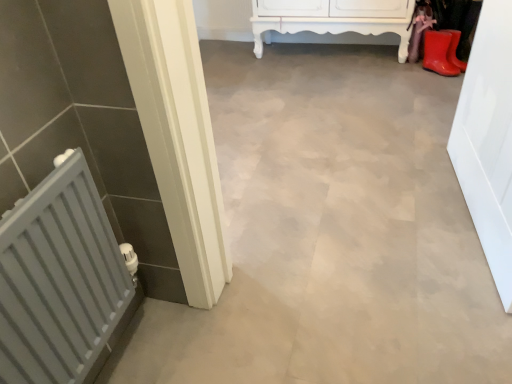
What do you see at coordinates (333, 18) in the screenshot? The height and width of the screenshot is (384, 512). I see `white glossy cabinet at upper center` at bounding box center [333, 18].

This screenshot has width=512, height=384. What do you see at coordinates (488, 140) in the screenshot? I see `white glossy door at right` at bounding box center [488, 140].

Where is `gray matte radiator at left`? The width and height of the screenshot is (512, 384). gray matte radiator at left is located at coordinates (59, 279).

Consider the image. Which is correct: gray matte radiator at left is inside white glossy cabinet at upper center, or outside of it?

The correct answer is: outside.

From a real-world perspective, is gray matte radiator at left located higher than white glossy cabinet at upper center?

Yes.

Is gray matte radiator at left bigger than white glossy cabinet at upper center?

No, gray matte radiator at left is not bigger than white glossy cabinet at upper center.

Between white glossy door at right and gray matte radiator at left, which one appears on the right side from the viewer's perspective?

Positioned to the right is white glossy door at right.

Is there a large distance between white glossy door at right and gray matte radiator at left?

Absolutely, white glossy door at right is distant from gray matte radiator at left.

Locate an element on the screen. This screenshot has width=512, height=384. door behind the gray matte radiator at left is located at coordinates (488, 140).

In terms of size, does white glossy door at right appear bigger or smaller than gray matte radiator at left?

white glossy door at right is bigger than gray matte radiator at left.

Which is nearer, (x=486, y=61) or (x=432, y=48)?

Clearly, point (x=486, y=61) is closer to the camera than point (x=432, y=48).

How different are the orientations of white glossy door at right and rubber matte boot at upper right in degrees?

The angle between the facing direction of white glossy door at right and the facing direction of rubber matte boot at upper right is 137 degrees.

In terms of width, does white glossy door at right look wider or thinner when compared to rubber matte boot at upper right?

Considering their sizes, white glossy door at right looks slimmer than rubber matte boot at upper right.

In the scene shown: Considering the positions of objects white glossy door at right and rubber matte boot at upper right in the image provided, who is more to the right, white glossy door at right or rubber matte boot at upper right?

From the viewer's perspective, rubber matte boot at upper right appears more on the right side.

From the image's perspective, which one is positioned higher, gray matte radiator at left or white glossy door at right?

white glossy door at right, from the image's perspective.

Which of these two, gray matte radiator at left or white glossy door at right, stands taller?

Standing taller between the two is white glossy door at right.

Can you see gray matte radiator at left touching white glossy door at right?

There is a gap between gray matte radiator at left and white glossy door at right.

Looking at this image, from a real-world perspective, who is located higher, white glossy cabinet at upper center or white glossy door at right?

From a 3D spatial view, white glossy door at right is above.

Does white glossy cabinet at upper center lie in front of white glossy door at right?

No, white glossy cabinet at upper center is further to the viewer.

Image resolution: width=512 pixels, height=384 pixels. What are the coordinates of `furniture on the left of white glossy door at right` in the screenshot? It's located at (333, 18).

Is point (426, 30) farther from camera compared to point (496, 107)?

Yes, it is behind point (496, 107).

Do you think rubber matte boot at upper right is within white glossy door at right, or outside of it?

rubber matte boot at upper right is located beyond the bounds of white glossy door at right.

The width and height of the screenshot is (512, 384). I want to click on door located on the left of rubber matte boot at upper right, so click(488, 140).

Considering the relative sizes of rubber matte boot at upper right and white glossy door at right in the image provided, is rubber matte boot at upper right bigger than white glossy door at right?

Actually, rubber matte boot at upper right might be smaller than white glossy door at right.

Is gray matte radiator at left completely or partially outside of rubber matte boot at upper right?

gray matte radiator at left is positioned outside rubber matte boot at upper right.

Based on the photo, considering the relative sizes of gray matte radiator at left and rubber matte boot at upper right in the image provided, is gray matte radiator at left smaller than rubber matte boot at upper right?

No.

Is point (60, 179) closer to viewer compared to point (426, 50)?

Yes, point (60, 179) is closer to viewer.

Between gray matte radiator at left and rubber matte boot at upper right, which one has larger width?

Wider between the two is rubber matte boot at upper right.

I want to click on radiator lying below the white glossy cabinet at upper center (from the image's perspective), so click(x=59, y=279).

Image resolution: width=512 pixels, height=384 pixels. In order to click on radiator in front of the white glossy door at right in this screenshot , I will do `click(59, 279)`.

Looking at the image, which one is located further to white glossy cabinet at upper center, gray matte radiator at left or white glossy door at right?

gray matte radiator at left.

Estimate the real-world distances between objects in this image. Which object is further from rubber matte boot at upper right, white glossy door at right or gray matte radiator at left?

Among the two, gray matte radiator at left is located further to rubber matte boot at upper right.

Based on their spatial positions, is white glossy door at right or white glossy cabinet at upper center further from gray matte radiator at left?

Based on the image, white glossy cabinet at upper center appears to be further to gray matte radiator at left.

Consider the image. Looking at the image, which one is located closer to rubber matte boot at upper right, gray matte radiator at left or white glossy door at right?

The object closer to rubber matte boot at upper right is white glossy door at right.

Looking at the image, which one is located closer to gray matte radiator at left, white glossy cabinet at upper center or rubber matte boot at upper right?

white glossy cabinet at upper center.

Considering their positions, is white glossy door at right positioned closer to gray matte radiator at left than rubber matte boot at upper right?

Among the two, white glossy door at right is located nearer to gray matte radiator at left.

Looking at the image, which one is located further to white glossy cabinet at upper center, rubber matte boot at upper right or white glossy door at right?

The object further to white glossy cabinet at upper center is white glossy door at right.

From the image, which object appears to be farther from white glossy door at right, gray matte radiator at left or white glossy cabinet at upper center?

white glossy cabinet at upper center is further to white glossy door at right.

Image resolution: width=512 pixels, height=384 pixels. Find the location of `footwear between gray matte radiator at left and white glossy cabinet at upper center along the z-axis`. footwear between gray matte radiator at left and white glossy cabinet at upper center along the z-axis is located at coordinates (438, 53).

This screenshot has height=384, width=512. Find the location of `door located between gray matte radiator at left and rubber matte boot at upper right in the depth direction`. door located between gray matte radiator at left and rubber matte boot at upper right in the depth direction is located at coordinates (488, 140).

This screenshot has height=384, width=512. I want to click on footwear between white glossy door at right and white glossy cabinet at upper center from front to back, so click(438, 53).

Locate an element on the screen. The width and height of the screenshot is (512, 384). door positioned between gray matte radiator at left and white glossy cabinet at upper center from near to far is located at coordinates (488, 140).